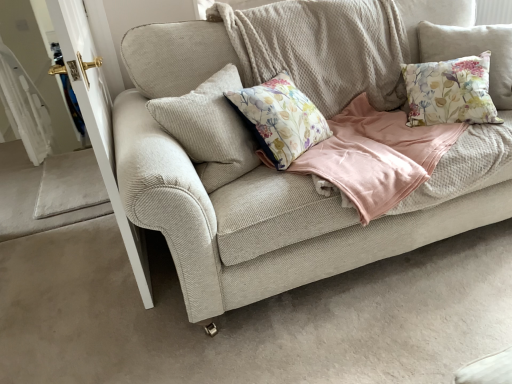
Question: Considering the relative sizes of beige corduroy couch at center and floral fabric cushion at upper right, acting as the first pillow starting from the right, in the image provided, is beige corduroy couch at center shorter than floral fabric cushion at upper right, acting as the first pillow starting from the right,?

Choices:
 (A) yes
 (B) no

Answer: (B)

Question: Is beige corduroy couch at center to the right of floral fabric cushion at upper right, acting as the first pillow starting from the right, from the viewer's perspective?

Choices:
 (A) yes
 (B) no

Answer: (B)

Question: Is beige corduroy couch at center surrounding floral fabric cushion at upper right, acting as the first pillow starting from the right?

Choices:
 (A) no
 (B) yes

Answer: (B)

Question: Does beige corduroy couch at center have a greater height compared to floral fabric cushion at upper right, acting as the first pillow starting from the right?

Choices:
 (A) yes
 (B) no

Answer: (A)

Question: From a real-world perspective, is beige corduroy couch at center on floral fabric cushion at upper right, acting as the first pillow starting from the right?

Choices:
 (A) yes
 (B) no

Answer: (B)

Question: In terms of width, does beige corduroy couch at center look wider or thinner when compared to white glossy door handle at left?

Choices:
 (A) thin
 (B) wide

Answer: (B)

Question: Choose the correct answer: Is beige corduroy couch at center inside white glossy door handle at left or outside it?

Choices:
 (A) outside
 (B) inside

Answer: (A)

Question: From the image's perspective, relative to white glossy door handle at left, is beige corduroy couch at center above or below?

Choices:
 (A) below
 (B) above

Answer: (B)

Question: In the image, is beige corduroy couch at center on the left side or the right side of white glossy door handle at left?

Choices:
 (A) right
 (B) left

Answer: (A)

Question: Based on their positions, is floral fabric cushion at upper right, acting as the first pillow starting from the right, located to the left or right of white glossy door handle at left?

Choices:
 (A) right
 (B) left

Answer: (A)

Question: From the image's perspective, relative to white glossy door handle at left, is floral fabric cushion at upper right, acting as the first pillow starting from the right, above or below?

Choices:
 (A) below
 (B) above

Answer: (B)

Question: From a real-world perspective, is floral fabric cushion at upper right, which is the second pillow from left to right, above or below white glossy door handle at left?

Choices:
 (A) below
 (B) above

Answer: (B)

Question: Is floral fabric cushion at upper right, which is the second pillow from left to right, wider or thinner than white glossy door handle at left?

Choices:
 (A) wide
 (B) thin

Answer: (A)

Question: From a real-world perspective, is beige corduroy couch at center positioned above or below floral fabric cushion at upper right, acting as the first pillow starting from the right?

Choices:
 (A) above
 (B) below

Answer: (B)

Question: Considering their positions, is beige corduroy couch at center located in front of or behind floral fabric cushion at upper right, which is the second pillow from left to right?

Choices:
 (A) front
 (B) behind

Answer: (A)